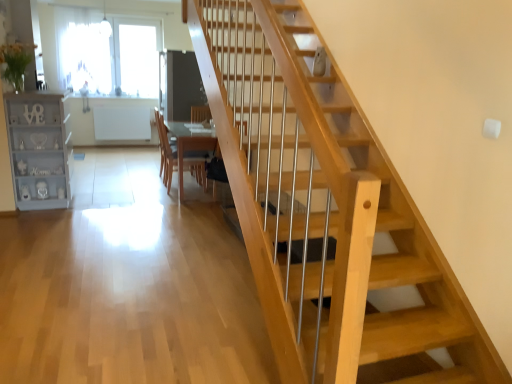
This screenshot has width=512, height=384. What do you see at coordinates (183, 155) in the screenshot? I see `wooden at center` at bounding box center [183, 155].

What do you see at coordinates (108, 53) in the screenshot?
I see `transparent glass window at upper left` at bounding box center [108, 53].

The width and height of the screenshot is (512, 384). Find the location of `transparent glass window at upper left`. transparent glass window at upper left is located at coordinates (108, 53).

Where is `light gray painted wood bookshelf at left`? The height and width of the screenshot is (384, 512). light gray painted wood bookshelf at left is located at coordinates (39, 149).

The height and width of the screenshot is (384, 512). I want to click on wooden at center, so click(x=183, y=155).

Considering the positions of objects transparent glass window at upper left and light gray painted wood bookshelf at left in the image provided, who is in front, transparent glass window at upper left or light gray painted wood bookshelf at left?

light gray painted wood bookshelf at left is closer to the camera.

From a real-world perspective, who is located higher, transparent glass window at upper left or light gray painted wood bookshelf at left?

transparent glass window at upper left.

From the picture: Is light gray painted wood bookshelf at left completely or partially inside wooden at center?

No, light gray painted wood bookshelf at left is located outside of wooden at center.

Which object is closer to the camera, wooden at center or light gray painted wood bookshelf at left?

light gray painted wood bookshelf at left is in front.

Looking at this image, considering the relative sizes of wooden at center and light gray painted wood bookshelf at left in the image provided, is wooden at center wider than light gray painted wood bookshelf at left?

No, wooden at center is not wider than light gray painted wood bookshelf at left.

In order to click on bookshelf positioned vertically above the wooden at center (from a real-world perspective) in this screenshot , I will do `click(39, 149)`.

Who is smaller, light gray painted wood bookshelf at left or wooden at center?

Smaller between the two is wooden at center.

Where is `bookshelf lying below the wooden at center (from the image's perspective)`? bookshelf lying below the wooden at center (from the image's perspective) is located at coordinates pyautogui.click(x=39, y=149).

From the picture: From the image's perspective, which one is positioned lower, light gray painted wood bookshelf at left or wooden at center?

light gray painted wood bookshelf at left is shown below in the image.

Is wooden at center bigger than transparent glass window at upper left?

No, wooden at center is not bigger than transparent glass window at upper left.

From a real-world perspective, is wooden at center beneath transparent glass window at upper left?

Correct, in the physical world, wooden at center is lower than transparent glass window at upper left.

Locate an element on the screen. chair below the transparent glass window at upper left (from the image's perspective) is located at coordinates (183, 155).

Is light gray painted wood bookshelf at left at the left side of transparent glass window at upper left?

Incorrect, light gray painted wood bookshelf at left is not on the left side of transparent glass window at upper left.

Consider the image. Is light gray painted wood bookshelf at left bigger than transparent glass window at upper left?

Correct, light gray painted wood bookshelf at left is larger in size than transparent glass window at upper left.

Where is `bookshelf that is in front of the transparent glass window at upper left`? bookshelf that is in front of the transparent glass window at upper left is located at coordinates (x=39, y=149).

Is transparent glass window at upper left not within wooden at center?

Yes, transparent glass window at upper left is not within wooden at center.

Is transparent glass window at upper left behind wooden at center?

Yes, transparent glass window at upper left is further from the camera.

Considering the sizes of transparent glass window at upper left and wooden at center in the image, is transparent glass window at upper left taller or shorter than wooden at center?

transparent glass window at upper left is taller than wooden at center.

Image resolution: width=512 pixels, height=384 pixels. In the image, there is a transparent glass window at upper left. Identify the location of bookshelf below it (from a real-world perspective). (39, 149).

At what (x,y) coordinates should I click in order to perform the action: click on chair that appears on the right of light gray painted wood bookshelf at left. Please return your answer as a coordinate pair (x, y). Looking at the image, I should click on (183, 155).

Considering their positions, is wooden at center positioned closer to light gray painted wood bookshelf at left than transparent glass window at upper left?

Based on the image, wooden at center appears to be nearer to light gray painted wood bookshelf at left.

When comparing their distances from transparent glass window at upper left, does light gray painted wood bookshelf at left or wooden at center seem further?

light gray painted wood bookshelf at left is positioned further to the anchor transparent glass window at upper left.

Estimate the real-world distances between objects in this image. Which object is closer to light gray painted wood bookshelf at left, transparent glass window at upper left or wooden at center?

wooden at center lies closer to light gray painted wood bookshelf at left than the other object.

When comparing their distances from wooden at center, does light gray painted wood bookshelf at left or transparent glass window at upper left seem further?

transparent glass window at upper left lies further to wooden at center than the other object.

Which object lies further to the anchor point wooden at center, transparent glass window at upper left or light gray painted wood bookshelf at left?

transparent glass window at upper left is further to wooden at center.

Looking at the image, which one is located closer to transparent glass window at upper left, wooden at center or light gray painted wood bookshelf at left?

Among the two, wooden at center is located nearer to transparent glass window at upper left.

What are the coordinates of `chair positioned between light gray painted wood bookshelf at left and transparent glass window at upper left from near to far` in the screenshot? It's located at (183, 155).